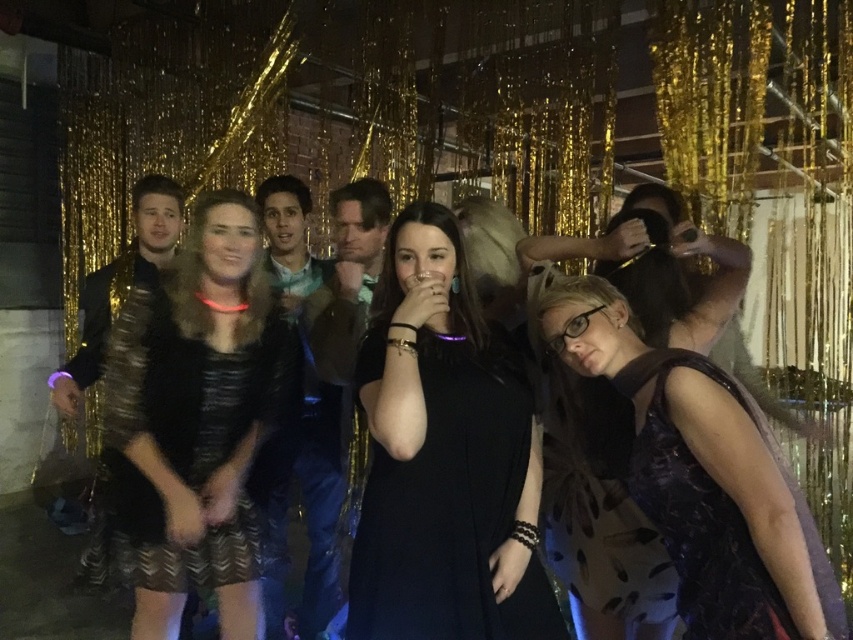
Can you confirm if black matte dress at center is positioned above shiny black jacket at left?

No, black matte dress at center is not above shiny black jacket at left.

Locate an element on the screen. This screenshot has height=640, width=853. black matte dress at center is located at coordinates (444, 458).

Does black matte dress at center have a lesser height compared to shiny blue jacket at center?

Yes.

Does point (519, 380) come behind point (283, 301)?

That is False.

Identify the location of black matte dress at center. pos(444,458).

Does black matte dress at center lie in front of shiny black dress at center?

Yes.

Which of these two, black matte dress at center or shiny black dress at center, stands shorter?

With less height is black matte dress at center.

This screenshot has width=853, height=640. I want to click on black matte dress at center, so click(x=444, y=458).